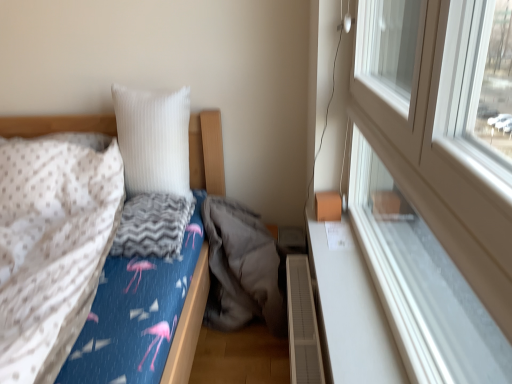
Question: From the image's perspective, does gray soft sleeping bag at center appear higher than gray zigzag blanket at center?

Choices:
 (A) no
 (B) yes

Answer: (A)

Question: Does gray soft sleeping bag at center have a smaller size compared to gray zigzag blanket at center?

Choices:
 (A) yes
 (B) no

Answer: (B)

Question: Is there a large distance between gray soft sleeping bag at center and gray zigzag blanket at center?

Choices:
 (A) yes
 (B) no

Answer: (B)

Question: Is gray soft sleeping bag at center thinner than gray zigzag blanket at center?

Choices:
 (A) no
 (B) yes

Answer: (A)

Question: Is gray soft sleeping bag at center wider than gray zigzag blanket at center?

Choices:
 (A) no
 (B) yes

Answer: (B)

Question: Is gray soft sleeping bag at center taller than gray zigzag blanket at center?

Choices:
 (A) no
 (B) yes

Answer: (B)

Question: From the image's perspective, does gray soft sleeping bag at center appear higher than flamingo-patterned fabric bed at left?

Choices:
 (A) no
 (B) yes

Answer: (B)

Question: Does gray soft sleeping bag at center have a larger size compared to flamingo-patterned fabric bed at left?

Choices:
 (A) yes
 (B) no

Answer: (B)

Question: Is gray soft sleeping bag at center facing away from flamingo-patterned fabric bed at left?

Choices:
 (A) no
 (B) yes

Answer: (A)

Question: Is gray soft sleeping bag at center placed right next to flamingo-patterned fabric bed at left?

Choices:
 (A) no
 (B) yes

Answer: (A)

Question: Can you confirm if gray soft sleeping bag at center is taller than flamingo-patterned fabric bed at left?

Choices:
 (A) no
 (B) yes

Answer: (A)

Question: Does gray soft sleeping bag at center have a smaller size compared to flamingo-patterned fabric bed at left?

Choices:
 (A) no
 (B) yes

Answer: (B)

Question: Is white ribbed pillow at upper center taller than gray soft sleeping bag at center?

Choices:
 (A) yes
 (B) no

Answer: (A)